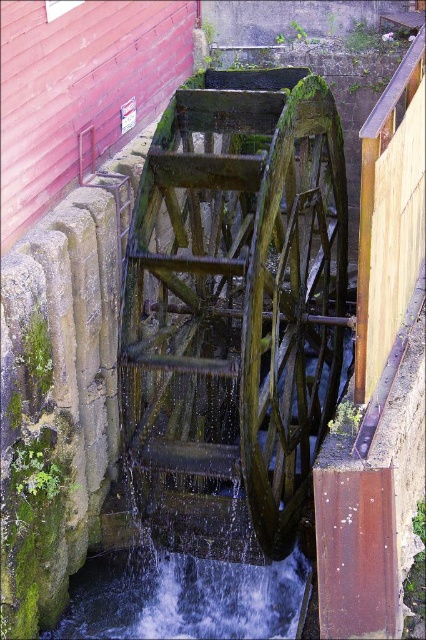
Question: Does green mossy wood at center appear on the right side of green mossy wood wheel at center?

Choices:
 (A) yes
 (B) no

Answer: (B)

Question: Does green mossy wood at center have a smaller size compared to green mossy wood wheel at center?

Choices:
 (A) yes
 (B) no

Answer: (B)

Question: Which point appears closest to the camera in this image?

Choices:
 (A) (281, 264)
 (B) (284, 282)

Answer: (A)

Question: Can you confirm if green mossy wood at center is thinner than green mossy wood wheel at center?

Choices:
 (A) no
 (B) yes

Answer: (A)